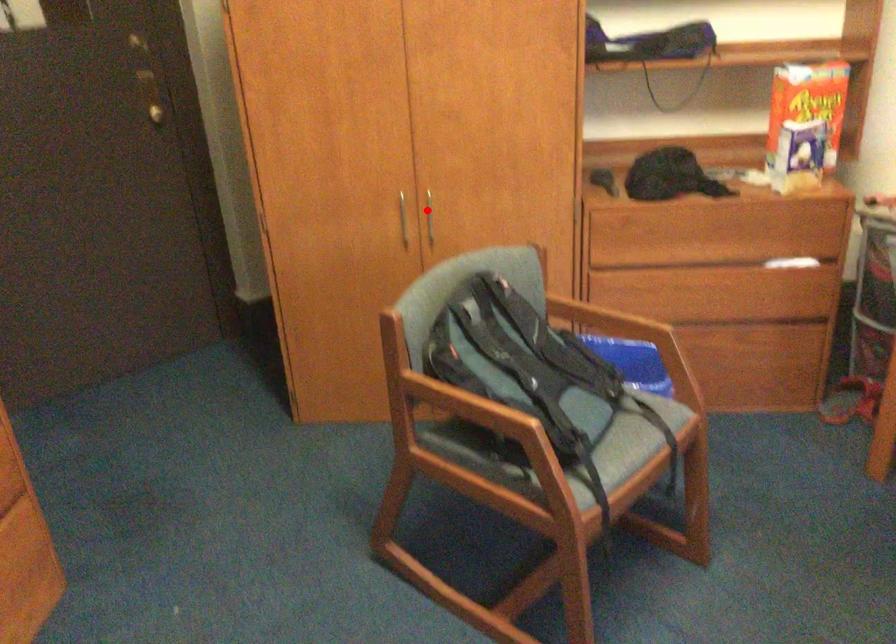
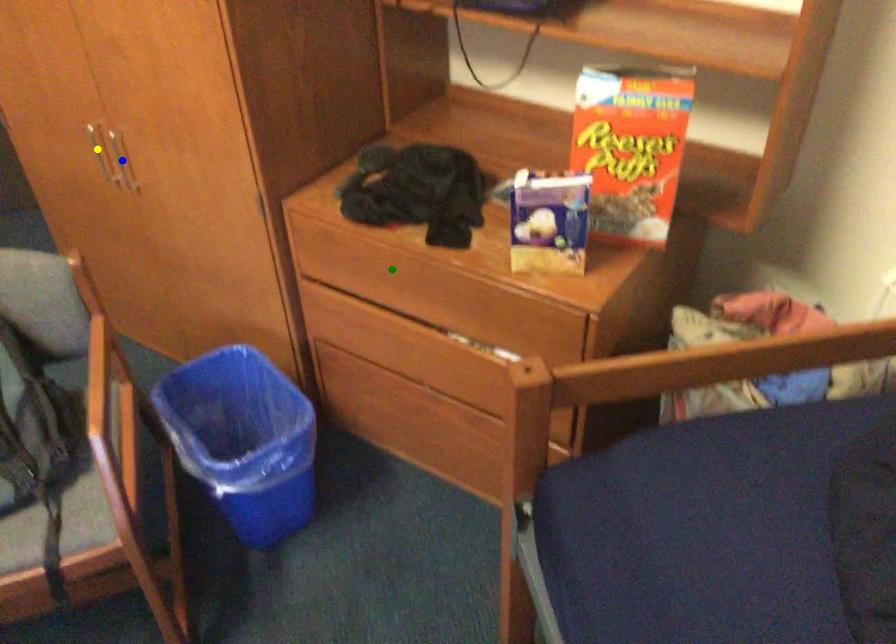
Question: I am providing you with two images of the same scene from different viewpoints. A red point is marked on the first image. You are given multiple points on the second image. Which spot in image 2 lines up with the point in image 1?

Choices:
 (A) blue point
 (B) green point
 (C) yellow point

Answer: (A)